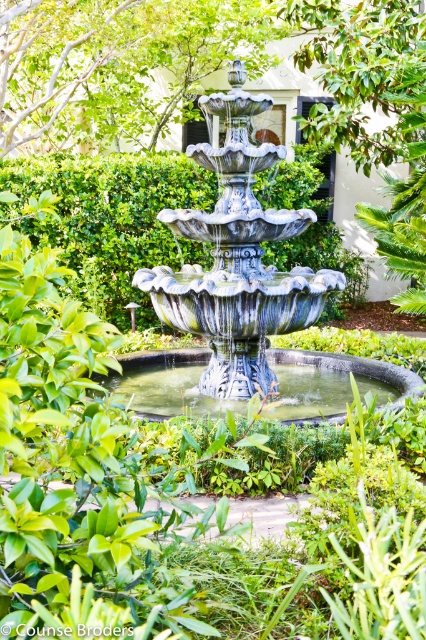
Question: From the image, what is the correct spatial relationship of stone fountain at center in relation to green leafy hedge at center?

Choices:
 (A) above
 (B) below

Answer: (B)

Question: Does stone fountain at center appear under metallic fountain at center?

Choices:
 (A) no
 (B) yes

Answer: (A)

Question: Which point is farther from the camera taking this photo?

Choices:
 (A) (227, 369)
 (B) (123, 369)

Answer: (B)

Question: Estimate the real-world distances between objects in this image. Which object is farther from the green leafy hedge at center?

Choices:
 (A) metallic fountain at center
 (B) stone fountain at center

Answer: (A)

Question: Which object is positioned closest to the metallic fountain at center?

Choices:
 (A) green leafy hedge at center
 (B) stone fountain at center

Answer: (B)

Question: Does green leafy hedge at center appear over metallic fountain at center?

Choices:
 (A) yes
 (B) no

Answer: (A)